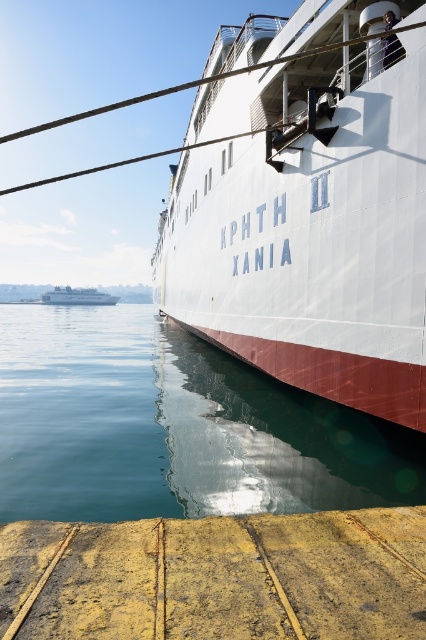
Question: Is yellow weathered wood at lower center in front of white glossy cruise ship at lower left?

Choices:
 (A) yes
 (B) no

Answer: (A)

Question: Is transparent water at lower left further to the viewer compared to yellow weathered wood at lower center?

Choices:
 (A) yes
 (B) no

Answer: (A)

Question: Among these objects, which one is nearest to the camera?

Choices:
 (A) white glossy cruise ship at center
 (B) transparent water at lower left
 (C) yellow weathered wood at lower center
 (D) white glossy cruise ship at lower left

Answer: (C)

Question: Is transparent water at lower left behind white glossy cruise ship at lower left?

Choices:
 (A) yes
 (B) no

Answer: (B)

Question: Which point is closer to the camera?

Choices:
 (A) pyautogui.click(x=365, y=612)
 (B) pyautogui.click(x=54, y=301)

Answer: (A)

Question: Which is nearer to the transparent water at lower left?

Choices:
 (A) yellow weathered wood at lower center
 (B) white glossy cruise ship at lower left

Answer: (A)